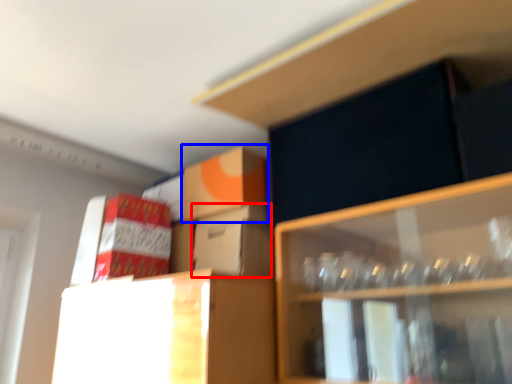
Question: Among these objects, which one is farthest to the camera, cardboard box (highlighted by a red box) or cardboard box (highlighted by a blue box)?

Choices:
 (A) cardboard box
 (B) cardboard box

Answer: (B)